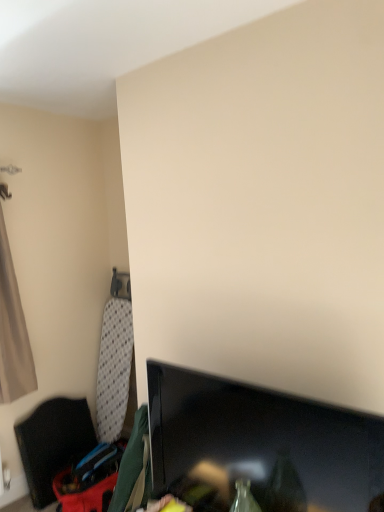
Question: Does beige fabric curtain at left have a lesser height compared to black glossy tv at lower right?

Choices:
 (A) no
 (B) yes

Answer: (A)

Question: Is beige fabric curtain at left directly adjacent to black glossy tv at lower right?

Choices:
 (A) yes
 (B) no

Answer: (B)

Question: Can you confirm if beige fabric curtain at left is thinner than black glossy tv at lower right?

Choices:
 (A) no
 (B) yes

Answer: (A)

Question: Is beige fabric curtain at left bigger than black glossy tv at lower right?

Choices:
 (A) yes
 (B) no

Answer: (A)

Question: Can you confirm if beige fabric curtain at left is wider than black glossy tv at lower right?

Choices:
 (A) no
 (B) yes

Answer: (B)

Question: Is beige fabric curtain at left far away from black glossy tv at lower right?

Choices:
 (A) no
 (B) yes

Answer: (B)

Question: From a real-world perspective, is black fabric chair at left physically below black glossy tv at lower right?

Choices:
 (A) yes
 (B) no

Answer: (A)

Question: Is black fabric chair at left wider than black glossy tv at lower right?

Choices:
 (A) no
 (B) yes

Answer: (B)

Question: Is black fabric chair at left far away from black glossy tv at lower right?

Choices:
 (A) yes
 (B) no

Answer: (A)

Question: Can you confirm if black fabric chair at left is thinner than black glossy tv at lower right?

Choices:
 (A) no
 (B) yes

Answer: (A)

Question: Is the position of black fabric chair at left more distant than that of black glossy tv at lower right?

Choices:
 (A) no
 (B) yes

Answer: (B)

Question: From a real-world perspective, is black fabric chair at left over black glossy tv at lower right?

Choices:
 (A) yes
 (B) no

Answer: (B)

Question: From the image's perspective, is black fabric chair at left located beneath beige fabric curtain at left?

Choices:
 (A) no
 (B) yes

Answer: (B)